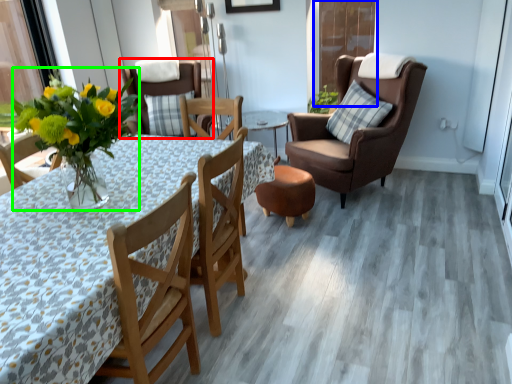
Question: Which is farther away from chair (highlighted by a red box)? screen door (highlighted by a blue box) or floral arrangement (highlighted by a green box)?

Choices:
 (A) screen door
 (B) floral arrangement

Answer: (B)